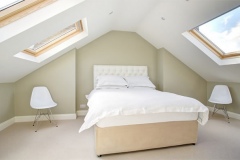
Where is `pillow`? Image resolution: width=240 pixels, height=160 pixels. pillow is located at coordinates (112, 82), (140, 76).